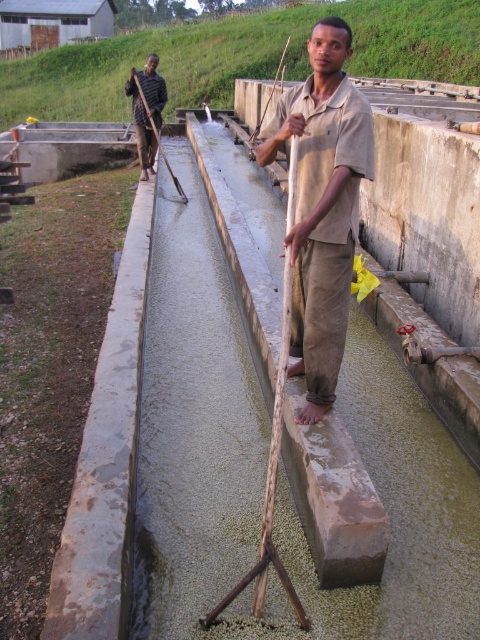
Is beige cotton shirt at center taller than dark brown wooden stick at upper left?

Yes, beige cotton shirt at center is taller than dark brown wooden stick at upper left.

Is beige cotton shirt at center positioned behind dark brown wooden stick at upper left?

No, beige cotton shirt at center is in front of dark brown wooden stick at upper left.

Is point (297, 321) positioned in front of point (132, 99)?

Yes, point (297, 321) is closer to viewer.

You are a GUI agent. You are given a task and a screenshot of the screen. Output one action in this format:
    pyautogui.click(x=<x>, y=<y>)
    Task: Click on the beige cotton shirt at center
    Image resolution: width=480 pixels, height=640 pixels.
    Given the screenshot: What is the action you would take?
    pos(323,205)